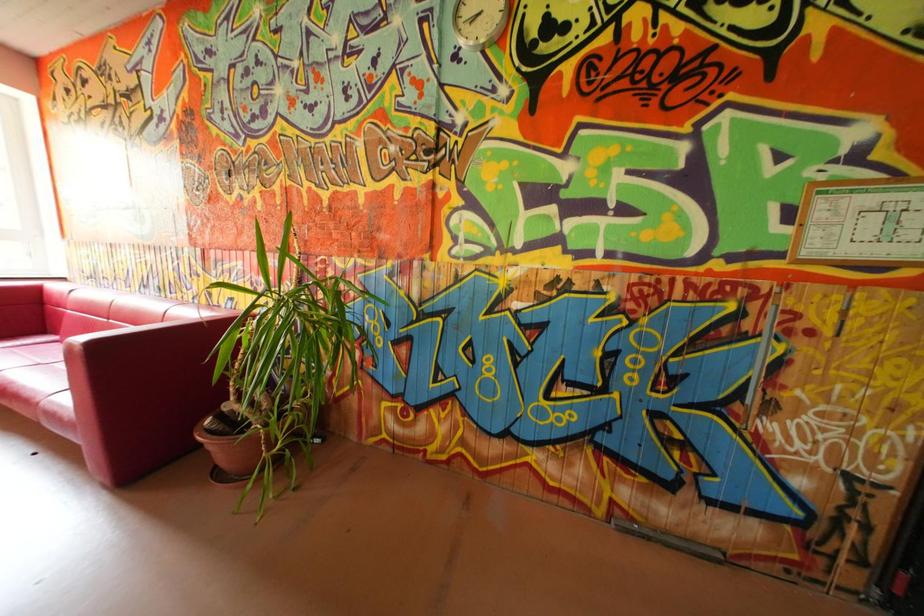
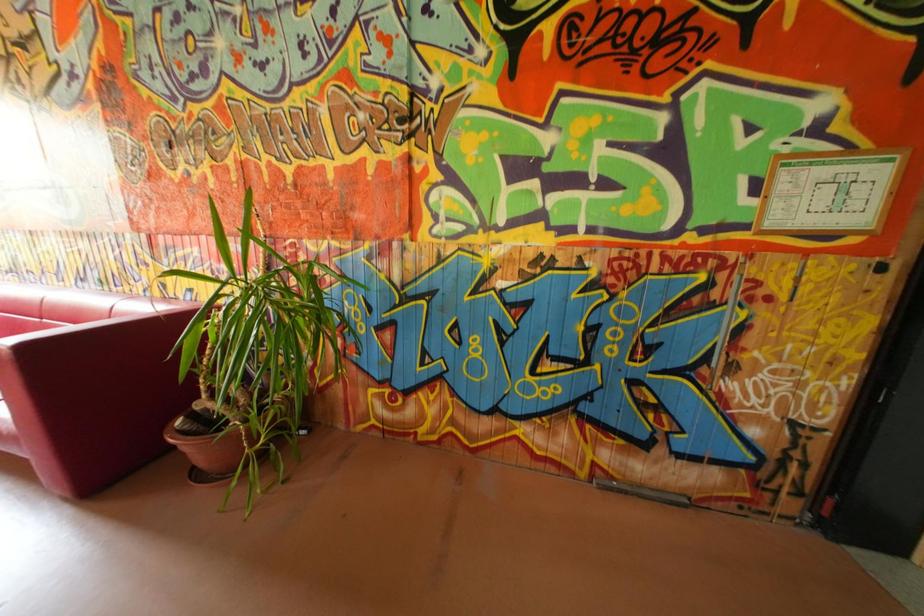
The images are taken continuously from a first-person perspective. In which direction are you moving?

The cameraman moved toward left, forward.